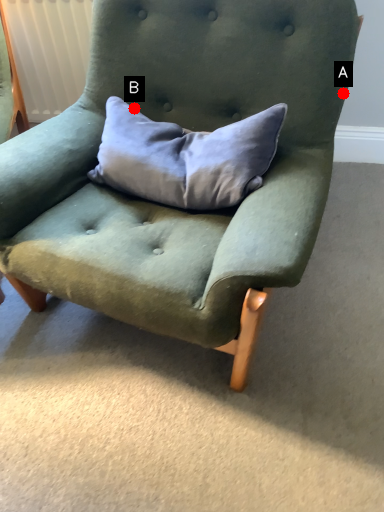
Question: Two points are circled on the image, labeled by A and B beside each circle. Which point is farther to the camera?

Choices:
 (A) A is further
 (B) B is further

Answer: (A)